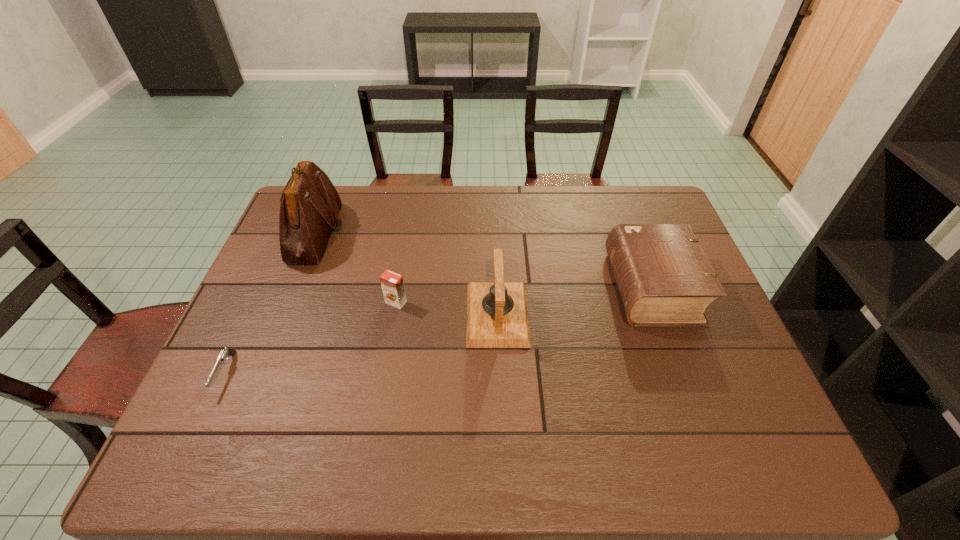
The image size is (960, 540). What are the coordinates of `the tallest object` in the screenshot? It's located at (310, 206).

The image size is (960, 540). What are the coordinates of `bell` in the screenshot? It's located at (497, 316).

Find the location of a particular element. Image resolution: width=960 pixels, height=540 pixels. the second object from right to left is located at coordinates (497, 316).

You are a GUI agent. You are given a task and a screenshot of the screen. Output one action in this format:
    pyautogui.click(x=<x>, y=<y>)
    Task: Click on the Bible
    This screenshot has height=540, width=960.
    Given the screenshot: What is the action you would take?
    pyautogui.click(x=664, y=278)

Identify the location of orange juice. The image size is (960, 540). (392, 284).

I want to click on the third object from left to right, so pos(392,284).

Locate an element on the screen. pistol is located at coordinates (225, 353).

Identify the location of the nearest object. Image resolution: width=960 pixels, height=540 pixels. (225, 353).

Identify the location of vacant space located on the front of the shoulder bag. (279, 326).

Locate an element on the screen. This screenshot has height=540, width=960. vacant space located on the front of the bell is located at coordinates (501, 409).